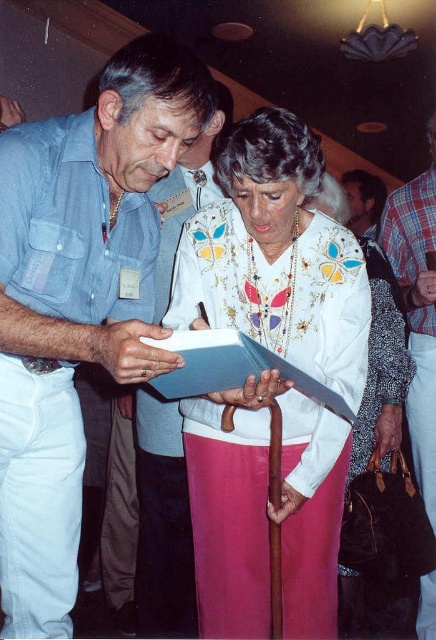
Question: Which object appears farthest from the camera in this image?

Choices:
 (A) plaid fabric shirt at right
 (B) matte blue shirt at center

Answer: (A)

Question: Which point is closer to the camera taking this photo?

Choices:
 (A) (255, 365)
 (B) (71, 129)
 (C) (292, 186)
 (D) (361, 179)

Answer: (B)

Question: Does matte blue shirt at center appear over white embroidered blouse at center?

Choices:
 (A) yes
 (B) no

Answer: (A)

Question: Which object is farther from the camera taking this photo?

Choices:
 (A) smooth brown leather jacket at upper center
 (B) plaid fabric shirt at right
 (C) white embroidered blouse at center
 (D) matte blue shirt at center

Answer: (A)

Question: Can you confirm if plaid fabric shirt at right is positioned above smooth brown leather jacket at upper center?

Choices:
 (A) yes
 (B) no

Answer: (B)

Question: Does plaid fabric shirt at right appear on the right side of blue paper clipboard at center?

Choices:
 (A) no
 (B) yes

Answer: (B)